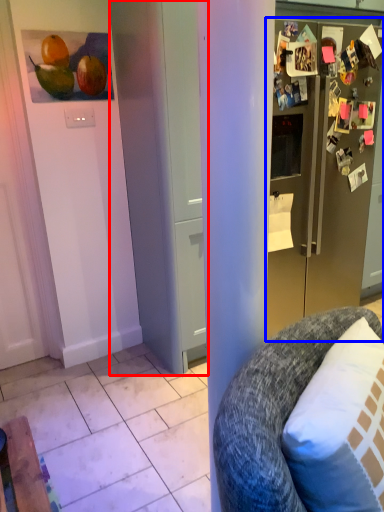
Question: Which object is closer to the camera taking this photo, door (highlighted by a red box) or refrigerator (highlighted by a blue box)?

Choices:
 (A) door
 (B) refrigerator

Answer: (A)